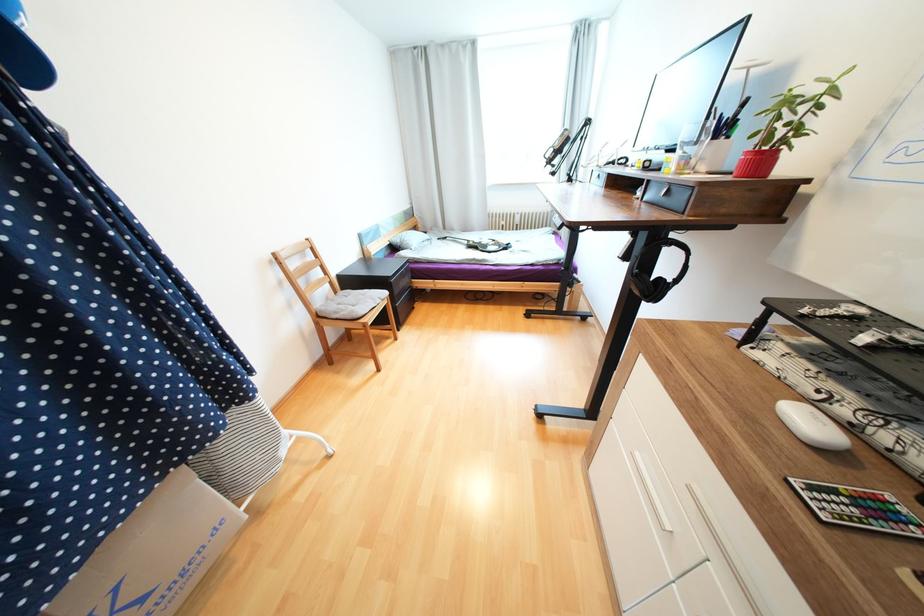
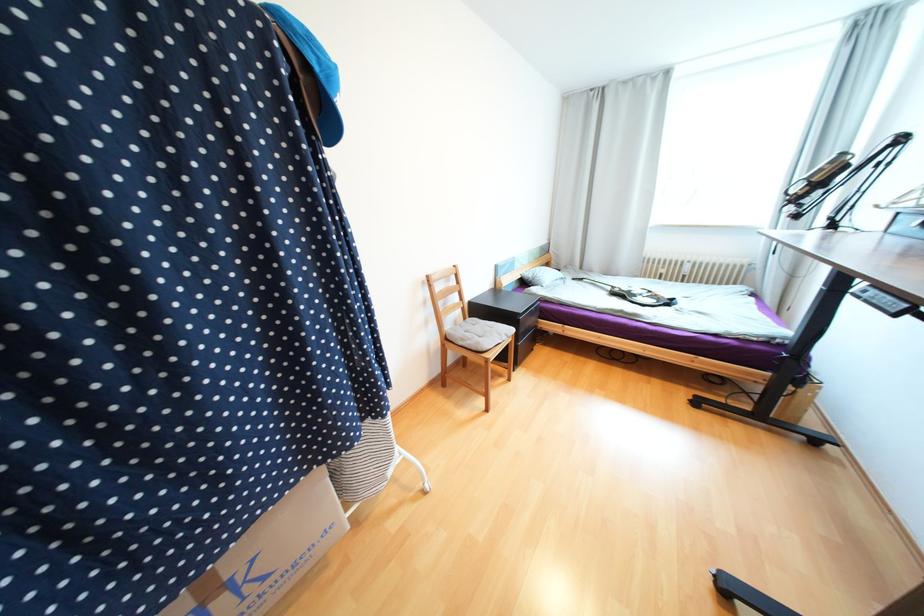
In the second image, find the point that corresponds to the point at 407,243 in the first image.

(540, 278)